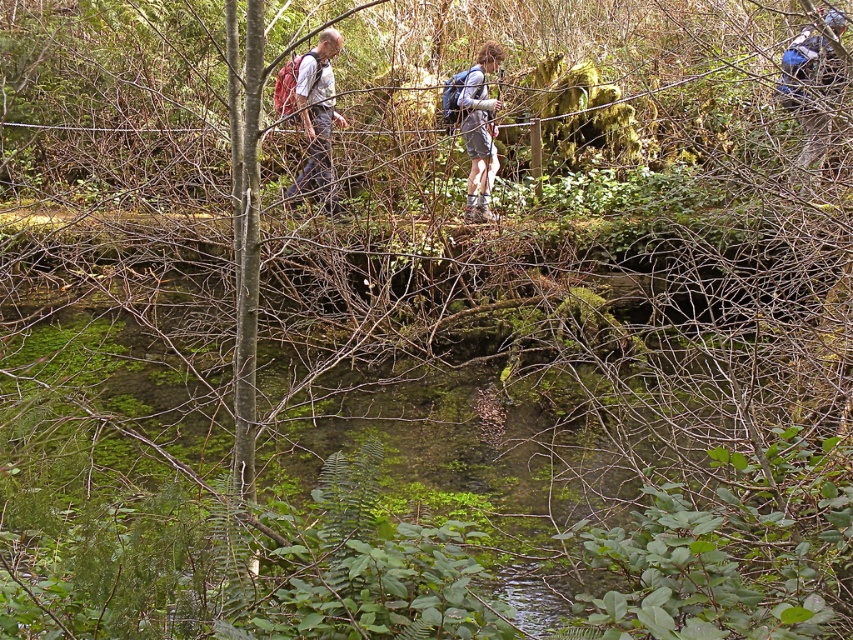
From the picture: Can you confirm if matte red backpack at upper left is taller than matte gray shorts at center?

Incorrect, matte red backpack at upper left's height is not larger of matte gray shorts at center's.

Locate an element on the screen. This screenshot has width=853, height=640. matte red backpack at upper left is located at coordinates (317, 118).